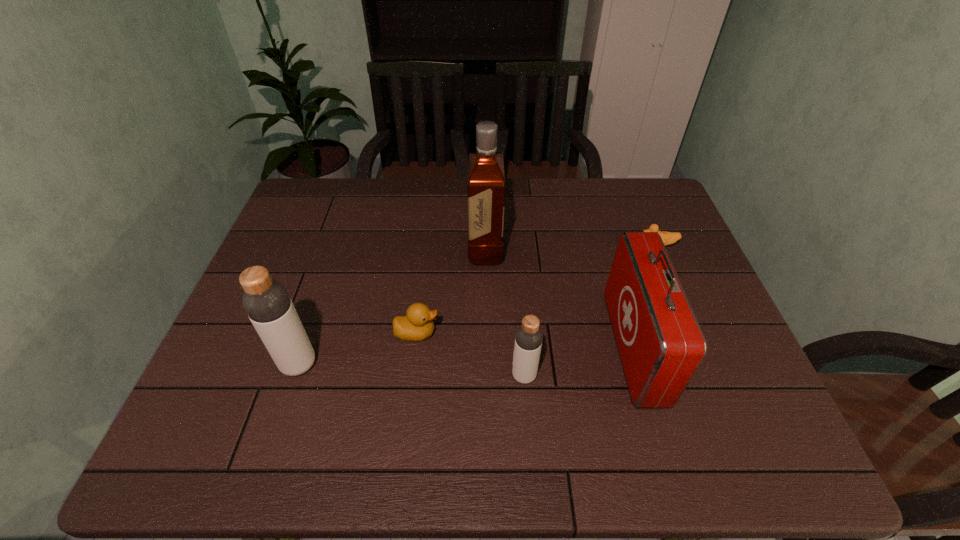
This screenshot has width=960, height=540. Find the location of `free spot located 0.210m on the side of the fifth object from left to right with the first aid cross symbol`. free spot located 0.210m on the side of the fifth object from left to right with the first aid cross symbol is located at coordinates pyautogui.click(x=528, y=348).

The width and height of the screenshot is (960, 540). Find the location of `blank space located on the side of the fifth object from left to right with the first aid cross symbol`. blank space located on the side of the fifth object from left to right with the first aid cross symbol is located at coordinates (465, 348).

At what (x,y) coordinates should I click in order to perform the action: click on free region located 0.280m on the side of the fifth object from left to right with the first aid cross symbol. Please return your answer as a coordinate pair (x, y). Image resolution: width=960 pixels, height=540 pixels. Looking at the image, I should click on (498, 348).

Where is `the first-aid kit that is positioned at the near edge`? Image resolution: width=960 pixels, height=540 pixels. the first-aid kit that is positioned at the near edge is located at coordinates (661, 345).

Identify the location of object located at the left edge. The height and width of the screenshot is (540, 960). (267, 303).

At what (x,y) coordinates should I click in order to perform the action: click on object that is at the right edge. Please return your answer as a coordinate pair (x, y). The image size is (960, 540). Looking at the image, I should click on pos(668,238).

Identify the location of object that is at the near left corner. The image size is (960, 540). (267, 303).

Find the location of a particular element. Image resolution: width=960 pixels, height=540 pixels. vacant point at the far edge is located at coordinates (508, 211).

I want to click on vacant region at the left edge of the desktop, so click(x=291, y=231).

Locate an element on the screen. The image size is (960, 540). vacant space at the far left corner of the desktop is located at coordinates (323, 185).